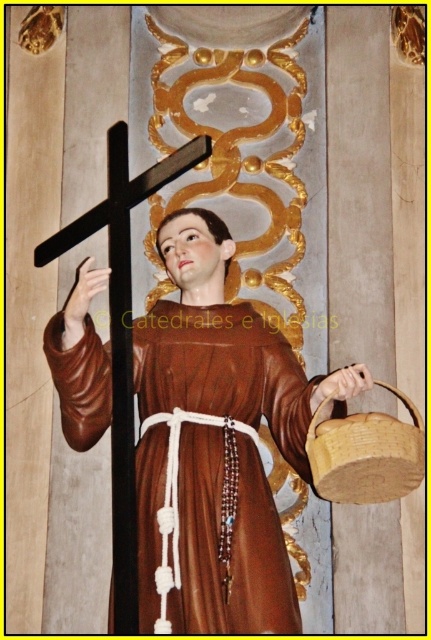
You are an art conservator tasked with cleaning the brown wooden statue at center and the brown woven basket at lower right. If you start at the back of the room, which object should you clean first to avoid having to walk around the statue?

The brown woven basket at lower right should be cleaned first because the brown wooden statue at center is in front of it. By starting with the basket, you can avoid having to walk around the statue afterward.